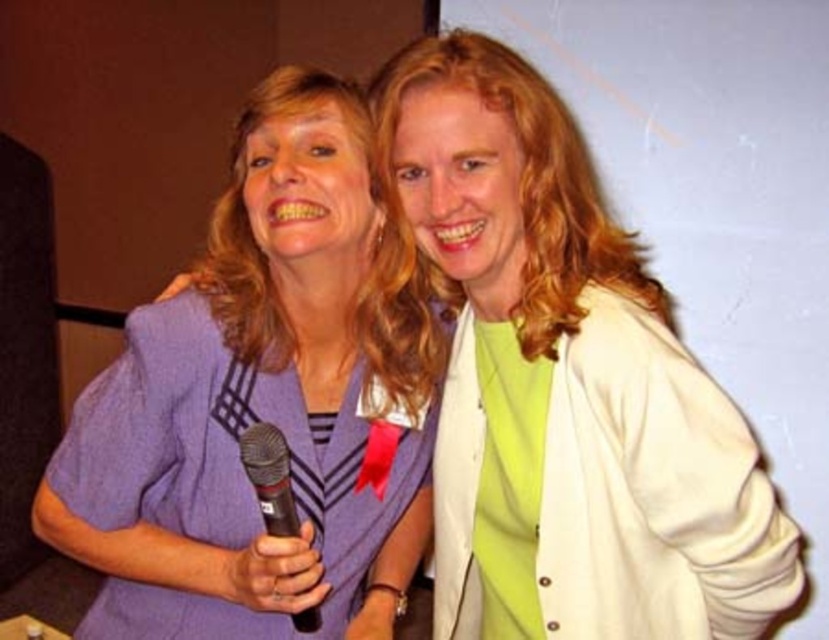
Question: Which point appears farthest from the camera in this image?

Choices:
 (A) pyautogui.click(x=262, y=452)
 (B) pyautogui.click(x=379, y=316)

Answer: (B)

Question: Does purple woolen blazer at left lie behind black matte microphone at center?

Choices:
 (A) yes
 (B) no

Answer: (A)

Question: From the image, what is the correct spatial relationship of purple woolen blazer at left in relation to black matte microphone at center?

Choices:
 (A) left
 (B) right

Answer: (B)

Question: Does purple woolen blazer at left lie in front of black matte microphone at center?

Choices:
 (A) yes
 (B) no

Answer: (B)

Question: Among these objects, which one is nearest to the camera?

Choices:
 (A) black matte microphone at center
 (B) purple woolen blazer at left

Answer: (A)